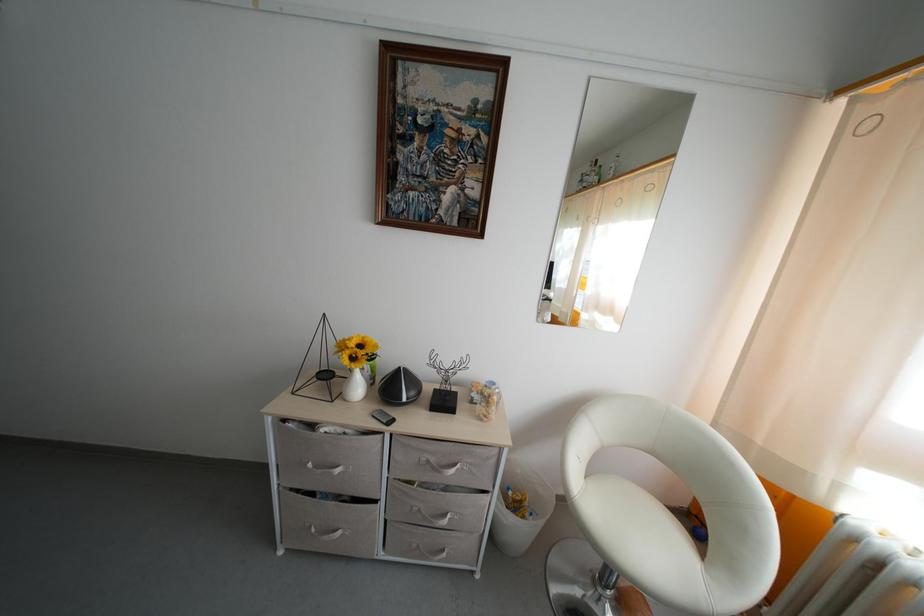
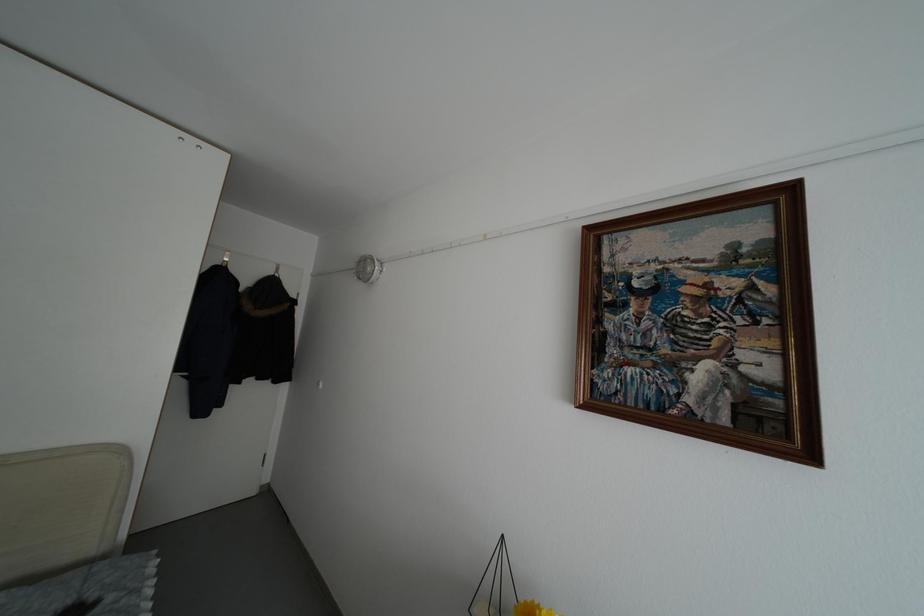
First-person continuous shooting, in which direction is the camera rotating?

The camera rotated toward left-up.